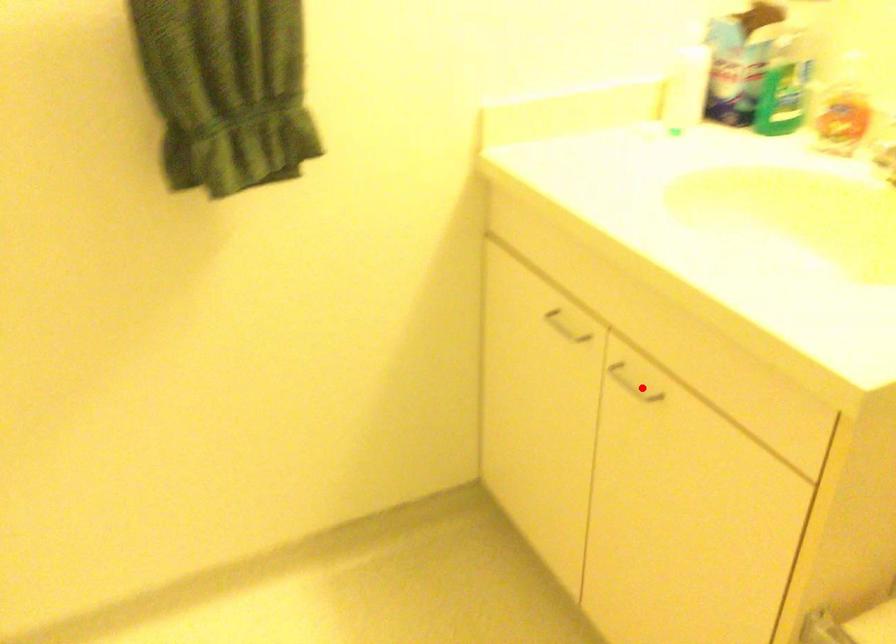
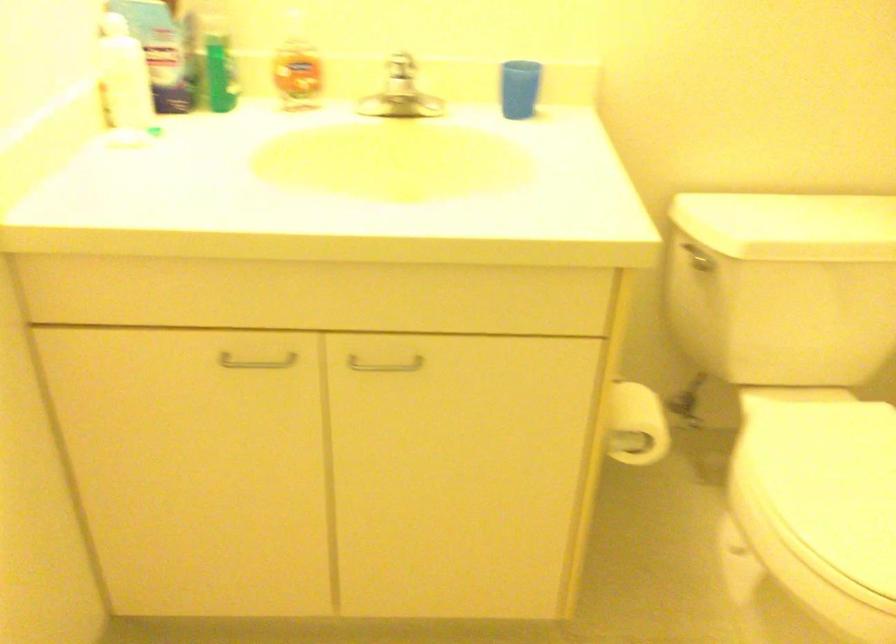
In the second image, find the point that corresponds to the highlighted location in the first image.

(384, 365)